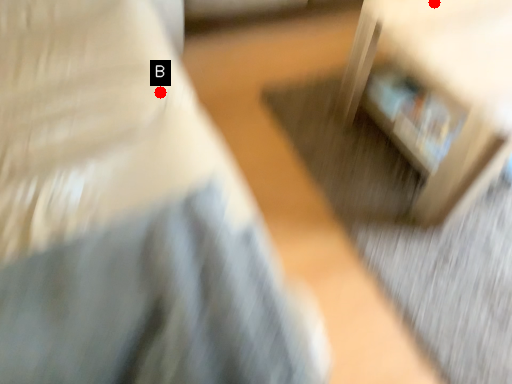
Question: Two points are circled on the image, labeled by A and B beside each circle. Which point is farther to the camera?

Choices:
 (A) A is further
 (B) B is further

Answer: (A)